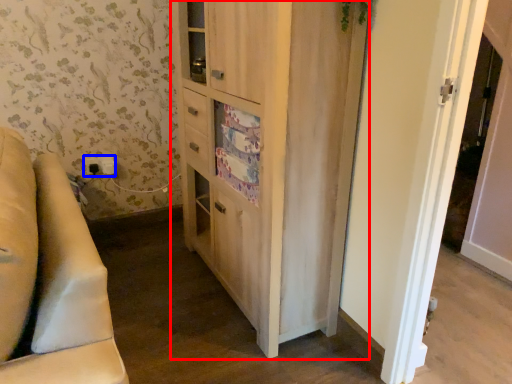
Question: Which object is further to the camera taking this photo, cabinetry (highlighted by a red box) or electric outlet (highlighted by a blue box)?

Choices:
 (A) cabinetry
 (B) electric outlet

Answer: (B)